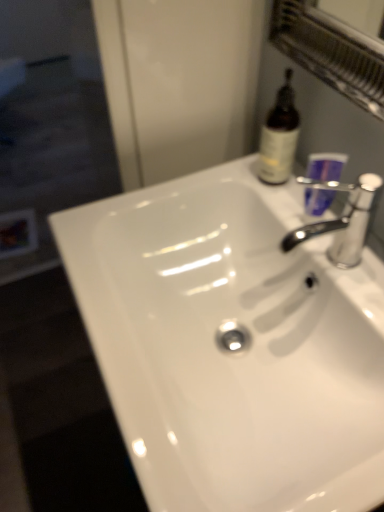
The height and width of the screenshot is (512, 384). I want to click on free spot in front of brown glass bottle at upper right, so click(x=304, y=211).